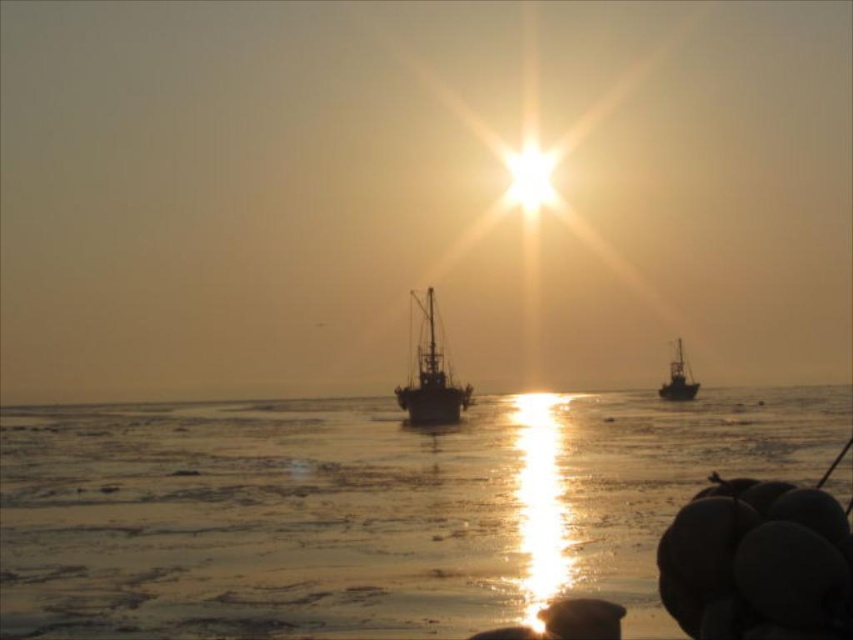
Based on the photo, is translucent ice at center taller than silvery metallic boat at right?

Indeed, translucent ice at center has a greater height compared to silvery metallic boat at right.

Between translucent ice at center and silvery metallic boat at right, which one appears on the left side from the viewer's perspective?

From the viewer's perspective, translucent ice at center appears more on the left side.

Measure the distance between translucent ice at center and camera.

translucent ice at center and camera are 42.60 feet apart from each other.

This screenshot has width=853, height=640. In order to click on translucent ice at center in this screenshot , I will do `click(368, 508)`.

Can you confirm if translucent ice at center is positioned to the left of dark gray metallic boat at center?

In fact, translucent ice at center is to the right of dark gray metallic boat at center.

In the scene shown: Which of these two, translucent ice at center or dark gray metallic boat at center, stands shorter?

dark gray metallic boat at center is shorter.

Image resolution: width=853 pixels, height=640 pixels. Find the location of `translucent ice at center`. translucent ice at center is located at coordinates (368, 508).

What do you see at coordinates (430, 376) in the screenshot? I see `dark gray metallic boat at center` at bounding box center [430, 376].

Which is above, dark gray metallic boat at center or silvery metallic boat at right?

dark gray metallic boat at center is higher up.

Is point (444, 380) positioned in front of point (666, 396)?

That is True.

Locate an element on the screen. This screenshot has width=853, height=640. dark gray metallic boat at center is located at coordinates (430, 376).